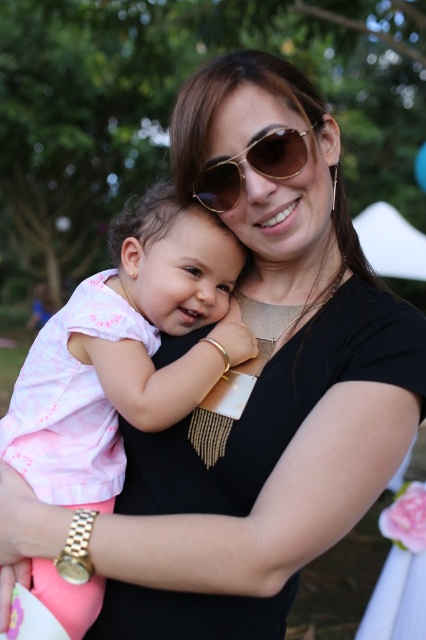
You are a photographer standing at point (60, 586). You want to take a photo of the woman and the child. Can you move closer to them without exceeding a distance of 1.2 meters from your current position?

They are 1.21 meters apart, so moving closer would exceed the 1.2 meter limit. You cannot move closer without exceeding the distance.

What are the coordinates of the pink cotton shirt at center?

The pink cotton shirt at center is located at point (126, 349).